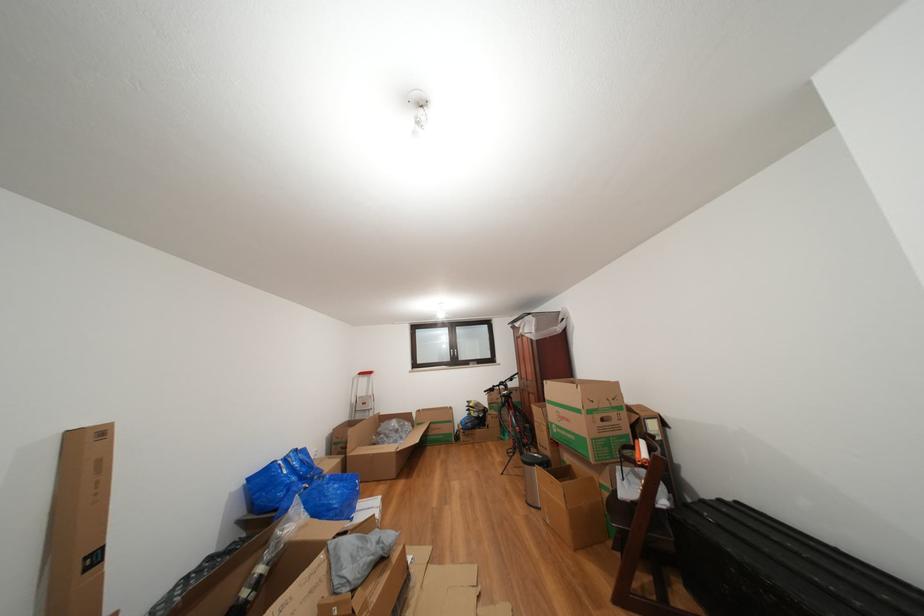
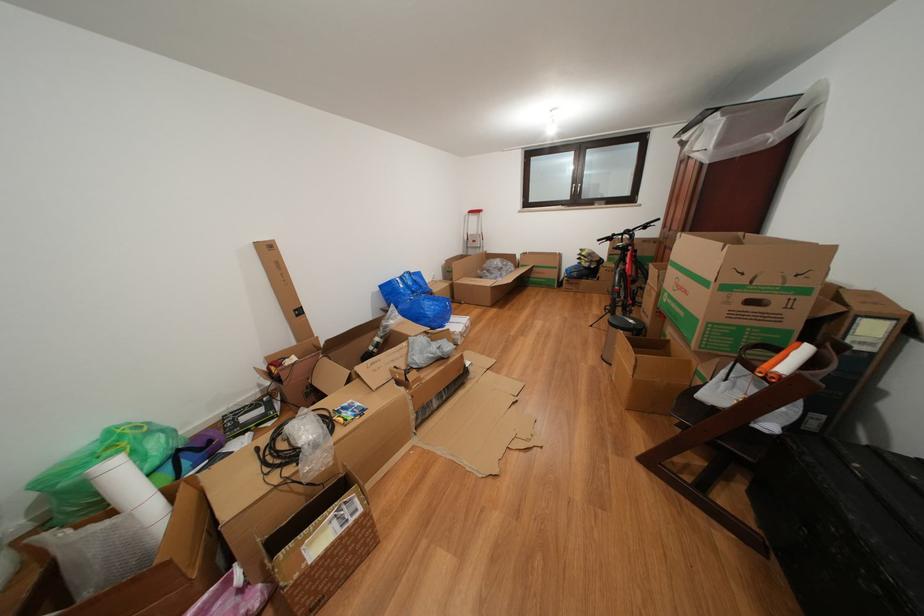
The point at (x=553, y=525) is marked in the first image. Where is the corresponding point in the second image?

(619, 382)